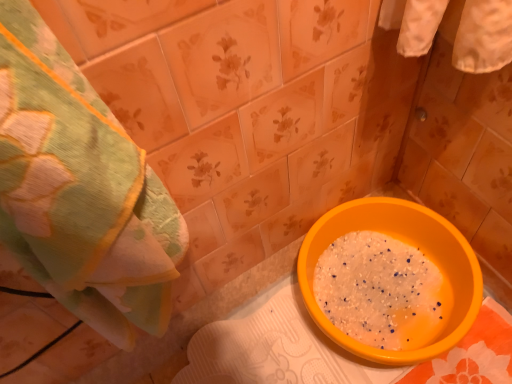
Identify the location of orange plastic basin at lower right. This screenshot has width=512, height=384. (409, 243).

Measure the distance between point (448, 275) and camera.

A distance of 36.38 inches exists between point (448, 275) and camera.

The width and height of the screenshot is (512, 384). What do you see at coordinates (409, 243) in the screenshot? I see `orange plastic basin at lower right` at bounding box center [409, 243].

Find the location of a particular element. green textured towel at left is located at coordinates (79, 189).

The height and width of the screenshot is (384, 512). Describe the element at coordinates (79, 189) in the screenshot. I see `green textured towel at left` at that location.

Locate an element on the screen. This screenshot has height=384, width=512. orange plastic basin at lower right is located at coordinates (409, 243).

Is orange plastic basin at lower right at the left side of green textured towel at left?

No, orange plastic basin at lower right is not to the left of green textured towel at left.

Is orange plastic basin at lower right positioned before green textured towel at left?

No, orange plastic basin at lower right is further to the viewer.

Considering the points (387, 354) and (117, 157), which point is behind, point (387, 354) or point (117, 157)?

The point (387, 354) is more distant.

From the image's perspective, does orange plastic basin at lower right appear higher than green textured towel at left?

No, from the image's perspective, orange plastic basin at lower right is not above green textured towel at left.

From a real-world perspective, is orange plastic basin at lower right physically above green textured towel at left?

Incorrect, from a real-world perspective, orange plastic basin at lower right is lower than green textured towel at left.

Considering the sizes of objects orange plastic basin at lower right and green textured towel at left in the image provided, who is thinner, orange plastic basin at lower right or green textured towel at left?

green textured towel at left is thinner.

Which of these two, orange plastic basin at lower right or green textured towel at left, stands taller?

green textured towel at left is taller.

Considering the sizes of orange plastic basin at lower right and green textured towel at left in the image, is orange plastic basin at lower right bigger or smaller than green textured towel at left?

Clearly, orange plastic basin at lower right is larger in size than green textured towel at left.

Do you think orange plastic basin at lower right is within green textured towel at left, or outside of it?

orange plastic basin at lower right exists outside the volume of green textured towel at left.

Would you say orange plastic basin at lower right is a long distance from green textured towel at left?

No, orange plastic basin at lower right is not far away from green textured towel at left.

Does orange plastic basin at lower right turn towards green textured towel at left?

No, orange plastic basin at lower right is not aimed at green textured towel at left.

Measure the distance between orange plastic basin at lower right and green textured towel at left.

The distance of orange plastic basin at lower right from green textured towel at left is 19.54 inches.

Locate an element on the screen. towel that is above the orange plastic basin at lower right (from the image's perspective) is located at coordinates (79, 189).

Between green textured towel at left and orange plastic basin at lower right, which one appears on the right side from the viewer's perspective?

Positioned to the right is orange plastic basin at lower right.

Who is more distant, green textured towel at left or orange plastic basin at lower right?

orange plastic basin at lower right.

Is point (159, 218) farther from camera compared to point (429, 221)?

No, (159, 218) is in front of (429, 221).

From the image's perspective, is green textured towel at left above or below orange plastic basin at lower right?

Based on their image positions, green textured towel at left is located above orange plastic basin at lower right.

From a real-world perspective, which is physically below, green textured towel at left or orange plastic basin at lower right?

In real-world perspective, orange plastic basin at lower right is lower.

Which of these two, green textured towel at left or orange plastic basin at lower right, is thinner?

green textured towel at left.

Does green textured towel at left have a greater height compared to orange plastic basin at lower right?

Yes, green textured towel at left is taller than orange plastic basin at lower right.

Does green textured towel at left have a larger size compared to orange plastic basin at lower right?

Actually, green textured towel at left might be smaller than orange plastic basin at lower right.

Based on the photo, which is correct: green textured towel at left is inside orange plastic basin at lower right, or outside of it?

green textured towel at left is not inside orange plastic basin at lower right, it's outside.

Are green textured towel at left and orange plastic basin at lower right making contact?

No.

Is green textured towel at left facing towards orange plastic basin at lower right?

No, green textured towel at left is not turned towards orange plastic basin at lower right.

You are a GUI agent. You are given a task and a screenshot of the screen. Output one action in this format:
    pyautogui.click(x=<x>, y=<y>)
    Task: Click on the towel located in front of the orange plastic basin at lower right
    This screenshot has height=384, width=512.
    Given the screenshot: What is the action you would take?
    pyautogui.click(x=79, y=189)

This screenshot has height=384, width=512. What are the coordinates of `basin located behind the green textured towel at left` in the screenshot? It's located at [x=409, y=243].

Locate an element on the screen. This screenshot has height=384, width=512. towel located above the orange plastic basin at lower right (from the image's perspective) is located at coordinates (79, 189).